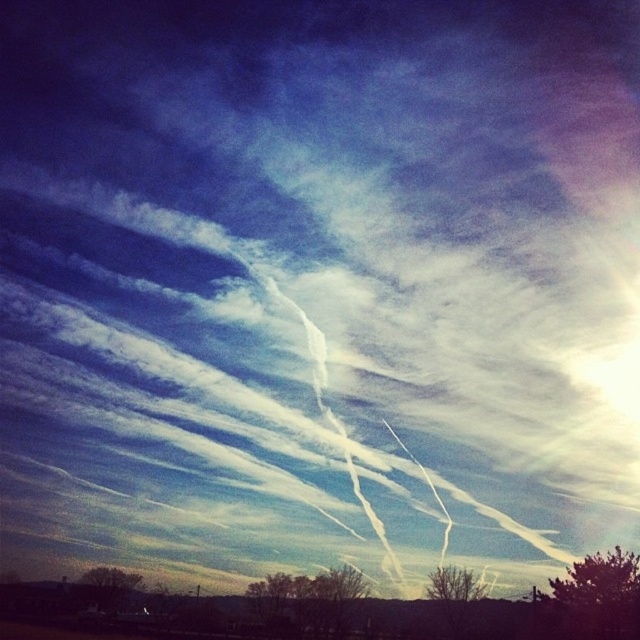
Based on the photo, you are standing in a field and see a point at coordinates [595,598]. According to the scene, what object is located at that point?

The point at coordinates [595,598] corresponds to the green leafy tree at lower right.

You are an artist planning to paint the scene. You want to ensure the trees at the bottom are proportionally accurate. Which tree should you paint narrower when comparing the brown textured tree at lower right and the brown textured tree at lower left?

The brown textured tree at lower right should be painted narrower because its width is less than the brown textured tree at lower left.